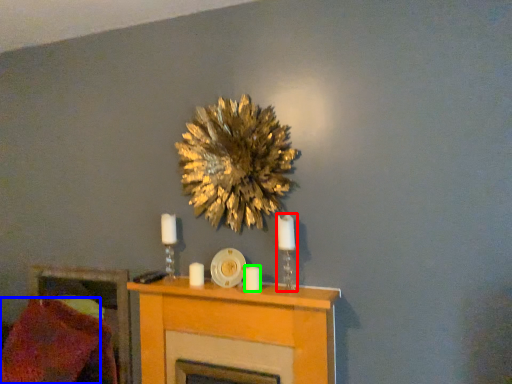
Question: Which is nearer to the candle holder (highlighted by a red box)? pillow (highlighted by a blue box) or candle (highlighted by a green box).

Choices:
 (A) pillow
 (B) candle

Answer: (B)